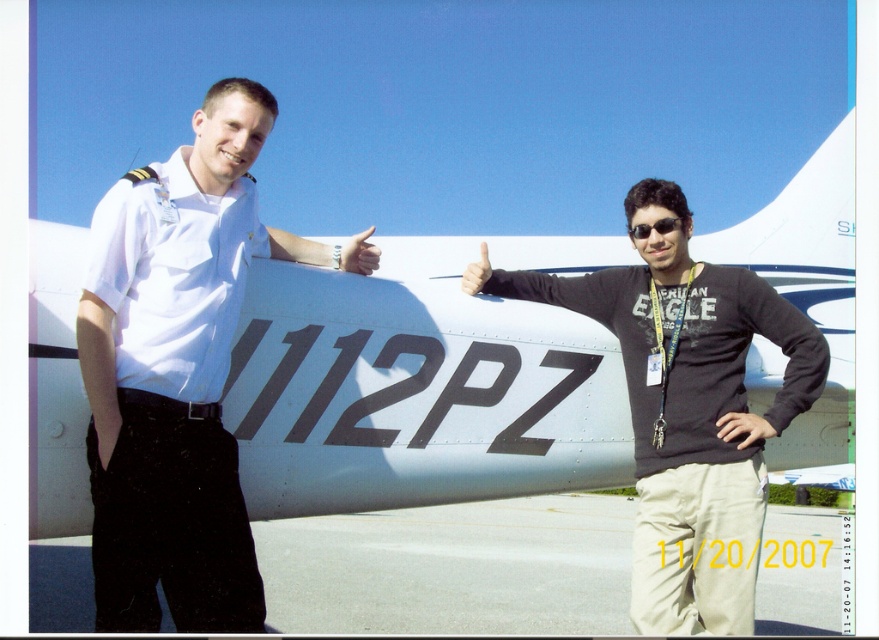
Can you confirm if white uniform shirt at center is positioned below matte black hand at center?

Correct, white uniform shirt at center is located below matte black hand at center.

Is white uniform shirt at center shorter than matte black hand at center?

In fact, white uniform shirt at center may be taller than matte black hand at center.

Find the location of a particular element. white uniform shirt at center is located at coordinates (688, 408).

This screenshot has height=640, width=879. Identify the location of white uniform shirt at center. (688, 408).

Image resolution: width=879 pixels, height=640 pixels. What are the coordinates of `white uniform shirt at center` in the screenshot? It's located at (688, 408).

From the picture: Can you confirm if white uniform shirt at center is positioned to the left of matte skin at center?

Incorrect, white uniform shirt at center is not on the left side of matte skin at center.

You are a GUI agent. You are given a task and a screenshot of the screen. Output one action in this format:
    pyautogui.click(x=<x>, y=<y>)
    Task: Click on the white uniform shirt at center
    The image size is (879, 640).
    Given the screenshot: What is the action you would take?
    pyautogui.click(x=688, y=408)

At what (x,y) coordinates should I click in order to perform the action: click on white uniform shirt at center. Please return your answer as a coordinate pair (x, y). Image resolution: width=879 pixels, height=640 pixels. Looking at the image, I should click on (688, 408).

Locate an element on the screen. The width and height of the screenshot is (879, 640). white shirt at center is located at coordinates (175, 372).

Between point (95, 228) and point (364, 253), which one is positioned in front?

Point (95, 228) is in front.

At what (x,y) coordinates should I click in order to perform the action: click on white shirt at center. Please return your answer as a coordinate pair (x, y). The height and width of the screenshot is (640, 879). Looking at the image, I should click on (175, 372).